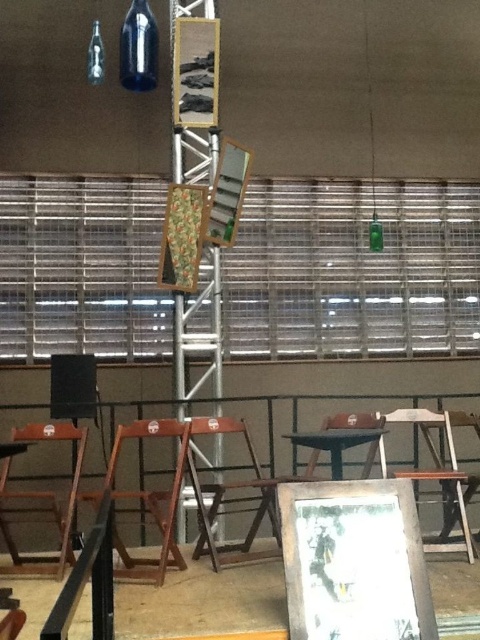
You are standing in the room and want to place a small potted plant between the wooden chair at lower right and the wooden at center. According to the scene description, where should the plant be placed relative to these two objects?

The wooden chair at lower right is below the wooden at center, so the plant should be placed between them horizontally, below the wooden at center and above the wooden chair at lower right.